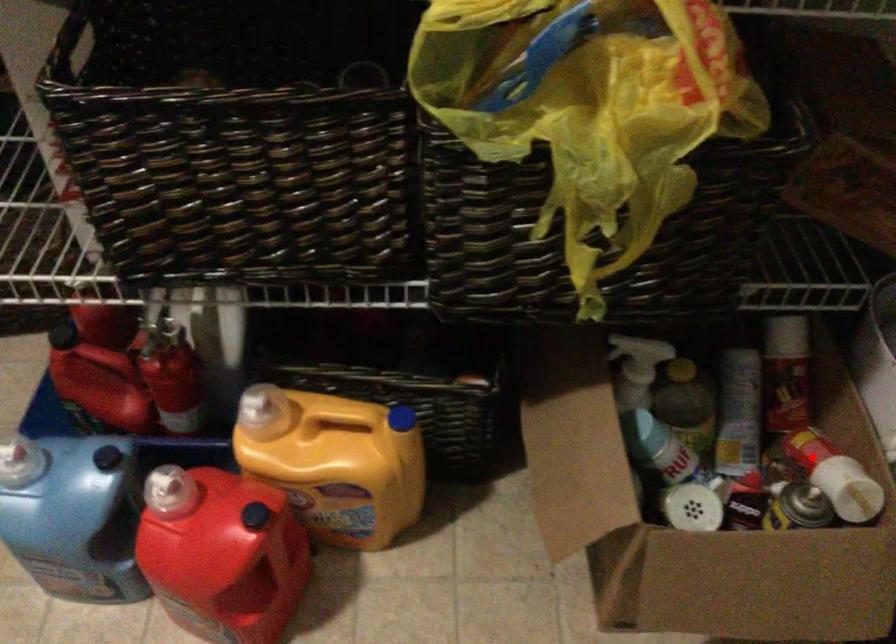
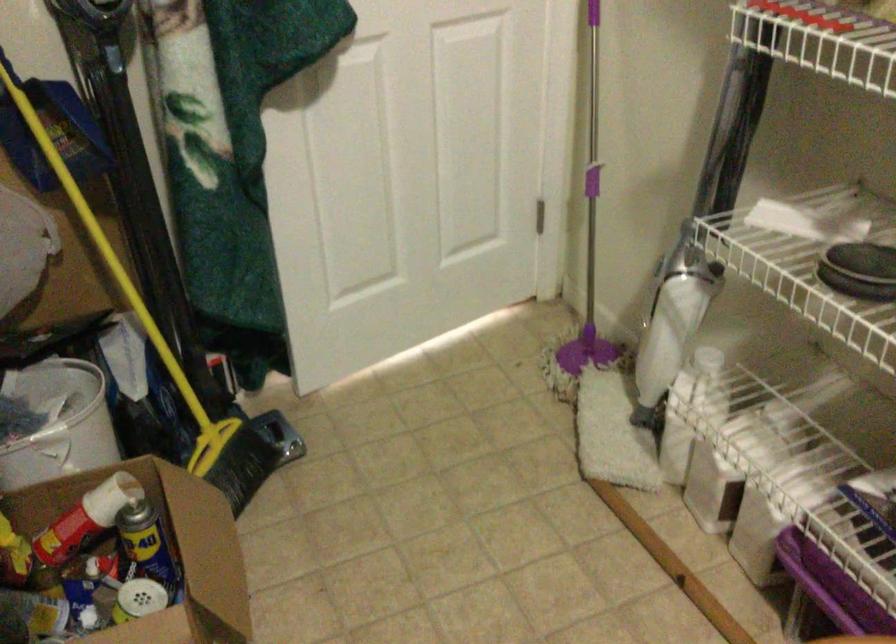
Find the pixel in the second image that matches the highlighted location in the first image.

(85, 518)